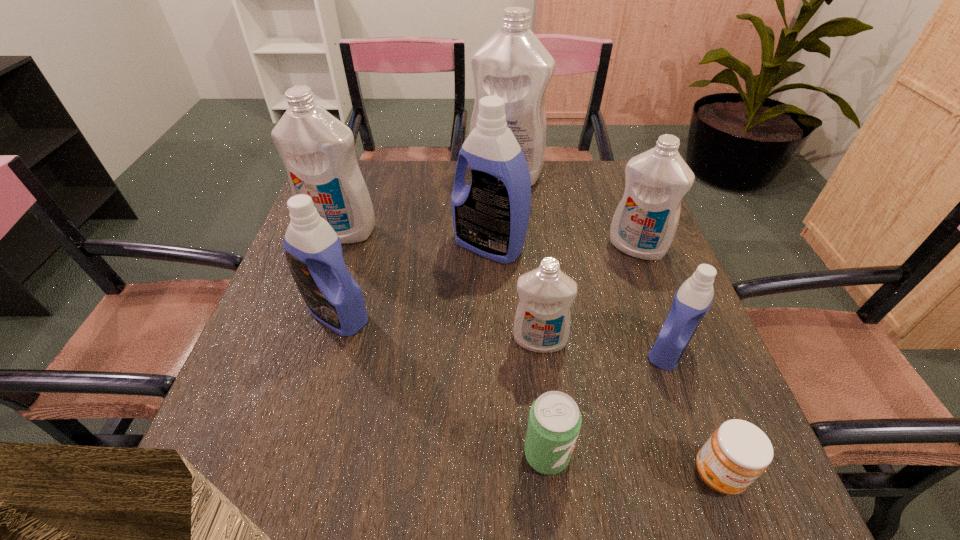
At what (x,y) coordinates should I click in order to perform the action: click on empty space that is in between the smallest blue detergent and the second smallest white detergent. Please return your answer as a coordinate pair (x, y). This screenshot has height=540, width=960. Looking at the image, I should click on (653, 299).

Locate an element on the screen. This screenshot has width=960, height=540. vacant space that's between the jam and the smallest blue detergent is located at coordinates (693, 411).

Find the location of `free space between the shortest object and the soda`. free space between the shortest object and the soda is located at coordinates [633, 464].

Find the location of a particular element. This screenshot has width=960, height=540. empty location between the rightmost blue detergent and the smallest white detergent is located at coordinates (604, 345).

Locate an element on the screen. This screenshot has height=540, width=960. vacant space that's between the smallest white detergent and the shortest object is located at coordinates (629, 407).

Where is `free space between the leftmost blue detergent and the rightmost white detergent`? The image size is (960, 540). free space between the leftmost blue detergent and the rightmost white detergent is located at coordinates (487, 281).

Find the location of a particular element. blank region between the leftmost white detergent and the shortest object is located at coordinates (530, 352).

At what (x,y) coordinates should I click in order to perform the action: click on free space between the second smallest blue detergent and the biggest blue detergent. Please return your answer as a coordinate pair (x, y). Looking at the image, I should click on tap(414, 280).

Find the location of a particular element. The width and height of the screenshot is (960, 540). free area in between the shortest object and the rightmost blue detergent is located at coordinates (693, 411).

Select which object appears as the eighth closest to the soda. Please provide its 2D coordinates. Your answer should be formatted as a tuple, i.e. [(x, y)], where the tuple contains the x and y coordinates of a point satisfying the conditions above.

[(513, 64)]